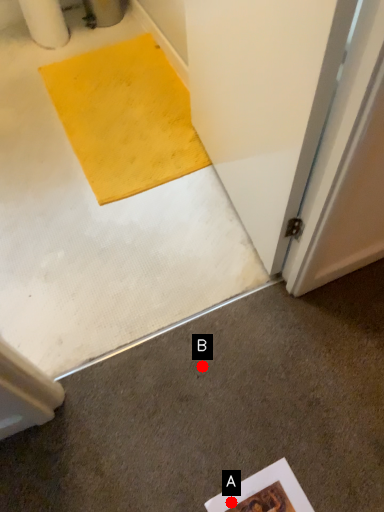
Question: Two points are circled on the image, labeled by A and B beside each circle. Which point is closer to the camera taking this photo?

Choices:
 (A) A is closer
 (B) B is closer

Answer: (A)